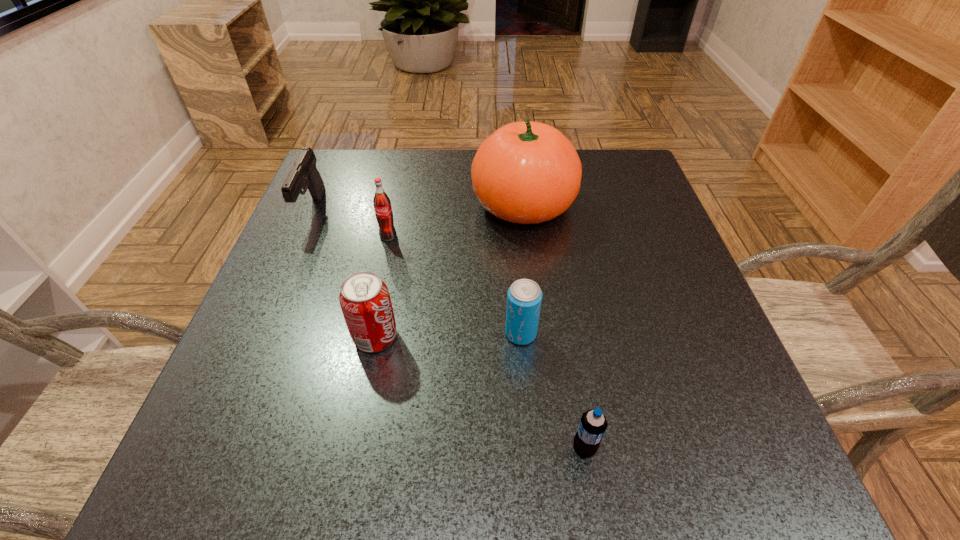
You are a GUI agent. You are given a task and a screenshot of the screen. Output one action in this format:
    pyautogui.click(x=<x>, y=<y>)
    Task: Click on the tallest object
    The height and width of the screenshot is (540, 960).
    Given the screenshot: What is the action you would take?
    pyautogui.click(x=526, y=172)

Where is `the farthest soda bottle`? the farthest soda bottle is located at coordinates (382, 205).

At what (x,y) coordinates should I click in order to perform the action: click on the leftmost object. Please return your answer as a coordinate pair (x, y). The height and width of the screenshot is (540, 960). Looking at the image, I should click on (304, 174).

This screenshot has height=540, width=960. I want to click on the second soda bottle from right to left, so click(524, 297).

Image resolution: width=960 pixels, height=540 pixels. I want to click on the rightmost soda bottle, so click(592, 426).

You are a GUI agent. You are given a task and a screenshot of the screen. Output one action in this format:
    pyautogui.click(x=<x>, y=<y>)
    Task: Click on the nearest object
    Image resolution: width=960 pixels, height=540 pixels.
    Given the screenshot: What is the action you would take?
    pyautogui.click(x=592, y=426)

Locate an element on the screen. The width and height of the screenshot is (960, 540). vacant space located on the left of the pumpkin is located at coordinates (307, 204).

Image resolution: width=960 pixels, height=540 pixels. In order to click on vacant area situated 0.370m on the label of the farthest soda bottle in this screenshot , I will do `click(351, 402)`.

This screenshot has height=540, width=960. Find the location of `free point located aim along the barrel of the leftmost object`. free point located aim along the barrel of the leftmost object is located at coordinates (252, 350).

Find the location of a particular element. Image resolution: width=960 pixels, height=540 pixels. vacant space situated 0.210m on the back of the second soda bottle from right to left is located at coordinates (514, 242).